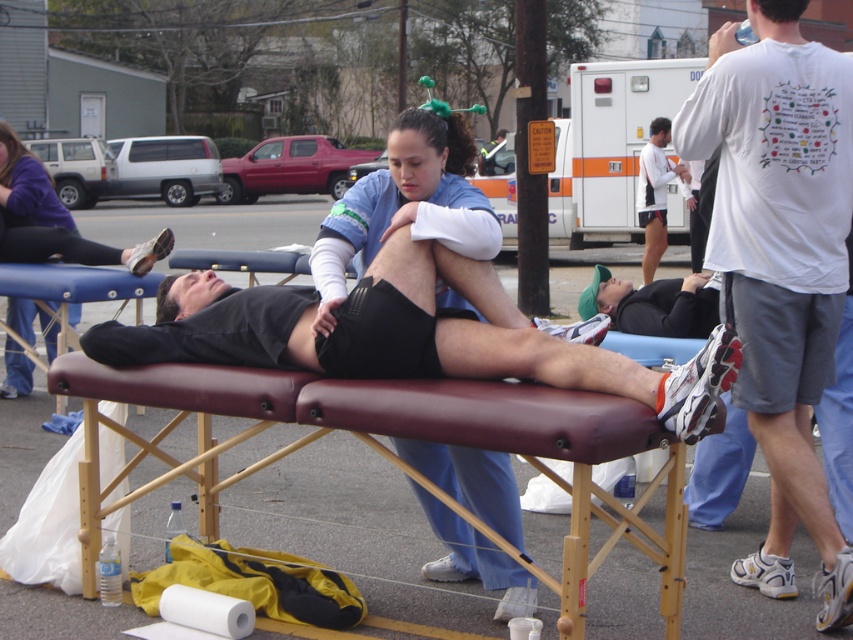
Question: Is maroon leather stretcher at center further to camera compared to matte black leg at upper left?

Choices:
 (A) no
 (B) yes

Answer: (A)

Question: Based on their relative distances, which object is nearer to the black matte shorts at center?

Choices:
 (A) white matte athletic shoe at lower center
 (B) maroon leather stretcher at center
 (C) white matte shorts at center

Answer: (A)

Question: Estimate the real-world distances between objects in this image. Which object is closer to the white cotton t-shirt at upper right?

Choices:
 (A) matte black leg at upper left
 (B) white matte shorts at center
 (C) white/orange ambulance at center
 (D) black matte shorts at center

Answer: (D)

Question: Where is matte black leg at upper left located in relation to black matte shirt at lower right in the image?

Choices:
 (A) below
 (B) above

Answer: (B)

Question: Is white cotton t-shirt at upper right to the right of black matte shirt at lower right from the viewer's perspective?

Choices:
 (A) yes
 (B) no

Answer: (A)

Question: Among these points, which one is nearest to the camera?

Choices:
 (A) (762, 3)
 (B) (16, 192)
 (C) (413, 285)
 (D) (688, 179)

Answer: (C)